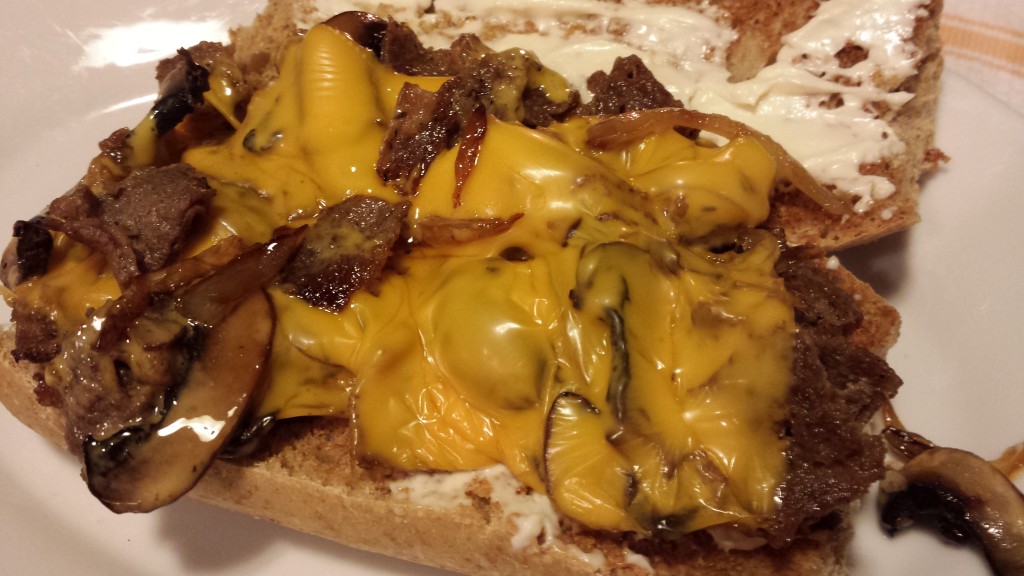
At what (x,y) coordinates should I click in order to perform the action: click on plate. Please return your answer as a coordinate pair (x, y). Looking at the image, I should click on (981, 343).